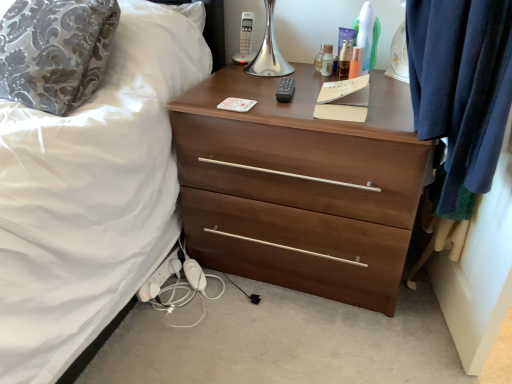
Question: Is black plastic remote at center not inside white plastic extension cord at lower left?

Choices:
 (A) yes
 (B) no

Answer: (A)

Question: Is white plastic extension cord at lower left a part of black plastic remote at center?

Choices:
 (A) no
 (B) yes

Answer: (A)

Question: From the image's perspective, would you say black plastic remote at center is shown under white plastic extension cord at lower left?

Choices:
 (A) yes
 (B) no

Answer: (B)

Question: From the image's perspective, is black plastic remote at center on white plastic extension cord at lower left?

Choices:
 (A) no
 (B) yes

Answer: (B)

Question: Is black plastic remote at center looking in the opposite direction of white plastic extension cord at lower left?

Choices:
 (A) no
 (B) yes

Answer: (A)

Question: Does black plastic remote at center appear on the left side of white plastic extension cord at lower left?

Choices:
 (A) yes
 (B) no

Answer: (B)

Question: From the image's perspective, is clear plastic bottle at upper center, the third toiletry viewed from the right, below white plastic extension cord at lower left?

Choices:
 (A) yes
 (B) no

Answer: (B)

Question: Does clear plastic bottle at upper center, which is counted as the 2th toiletry, starting from the left, have a lesser width compared to white plastic extension cord at lower left?

Choices:
 (A) no
 (B) yes

Answer: (B)

Question: Can you confirm if clear plastic bottle at upper center, which is counted as the 2th toiletry, starting from the left, is bigger than white plastic extension cord at lower left?

Choices:
 (A) no
 (B) yes

Answer: (A)

Question: From the image's perspective, would you say clear plastic bottle at upper center, the third toiletry viewed from the right, is positioned over white plastic extension cord at lower left?

Choices:
 (A) yes
 (B) no

Answer: (A)

Question: From a real-world perspective, does clear plastic bottle at upper center, the third toiletry viewed from the right, stand above white plastic extension cord at lower left?

Choices:
 (A) yes
 (B) no

Answer: (A)

Question: Does clear plastic bottle at upper center, which is counted as the 2th toiletry, starting from the left, turn towards white plastic extension cord at lower left?

Choices:
 (A) yes
 (B) no

Answer: (B)

Question: From the image's perspective, is black plastic remote at center below clear plastic bottle at upper center, placed as the 4th toiletry when sorted from right to left?

Choices:
 (A) no
 (B) yes

Answer: (B)